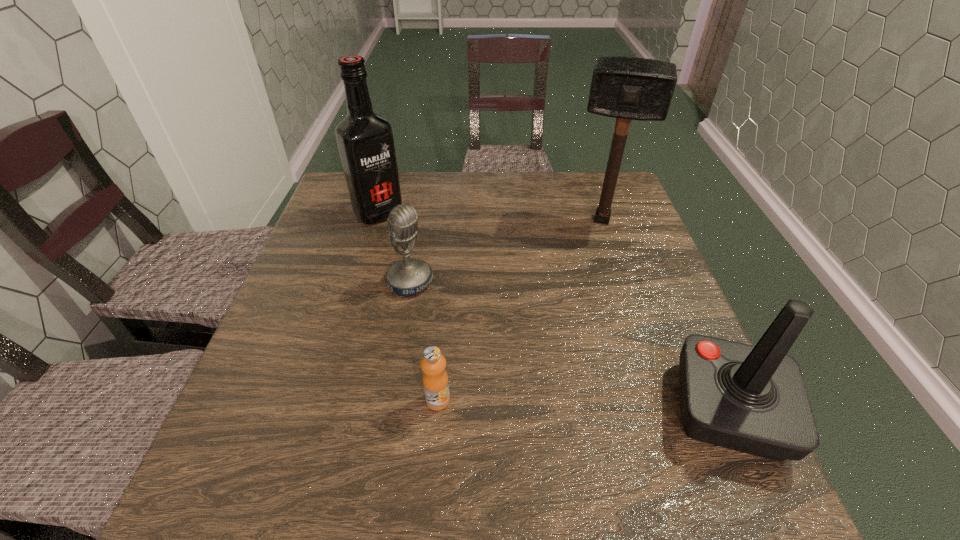
This screenshot has width=960, height=540. Find the location of `the shortest object`. the shortest object is located at coordinates (435, 379).

Find the location of a particular element. The width and height of the screenshot is (960, 540). the third object from right to left is located at coordinates (435, 379).

Locate an element on the screen. joystick is located at coordinates (752, 399).

This screenshot has width=960, height=540. What are the coordinates of `the third farthest object` in the screenshot? It's located at (407, 277).

The height and width of the screenshot is (540, 960). I want to click on microphone, so click(407, 277).

Find the location of a particular element. This screenshot has width=960, height=540. mallet is located at coordinates click(x=626, y=88).

Locate an element on the screen. This screenshot has width=960, height=540. liquor is located at coordinates pyautogui.click(x=365, y=140).

Find the location of `free region located on the front label of the third object from right to left`. free region located on the front label of the third object from right to left is located at coordinates (435, 443).

At what (x,y) coordinates should I click in order to perform the action: click on free space located 0.240m on the left of the joystick. Please return your answer as a coordinate pair (x, y). The image size is (960, 540). Looking at the image, I should click on (535, 410).

This screenshot has width=960, height=540. In order to click on free spot located on the front-facing side of the microphone in this screenshot , I will do `click(492, 339)`.